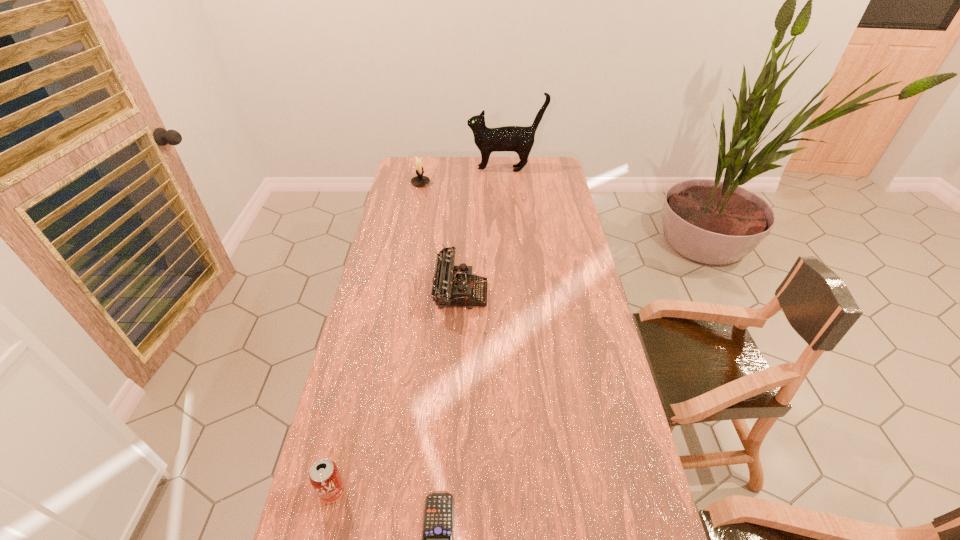
Locate an element on the screen. Image resolution: width=960 pixels, height=540 pixels. object that is the closest to the farthest object is located at coordinates (419, 180).

The width and height of the screenshot is (960, 540). I want to click on free space in the image that satisfies the following two spatial constraints: 1. on the face of the tallest object; 2. on the front side of the candle holder, so click(x=507, y=183).